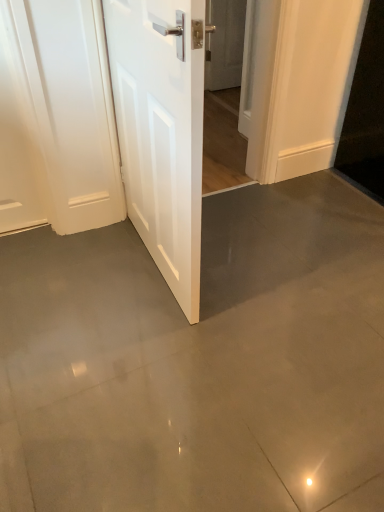
Describe the element at coordinates (161, 130) in the screenshot. The image size is (384, 512). I see `white glossy door at center, positioned as the second door in top-to-bottom order` at that location.

Measure the distance between white glossy door at center, which is the 1th door in front-to-back order, and camera.

The distance of white glossy door at center, which is the 1th door in front-to-back order, from camera is 35.45 inches.

How much space does white glossy door at center, positioned as the second door in top-to-bottom order, occupy horizontally?

5.28 inches.

The width and height of the screenshot is (384, 512). In order to click on white glossy door at center, which is the 1th door in front-to-back order in this screenshot , I will do `click(161, 130)`.

What do you see at coordinates (224, 42) in the screenshot? The width and height of the screenshot is (384, 512). I see `white glossy door at upper center, marked as the second door in a left-to-right arrangement` at bounding box center [224, 42].

From the picture: In order to face white glossy door at upper center, which appears as the first door when viewed from the top, should I rotate leftwards or rightwards?

You should rotate right by 5.742 degrees.

Image resolution: width=384 pixels, height=512 pixels. In order to click on white glossy door at upper center, which is the first door from right to left in this screenshot , I will do `click(224, 42)`.

Find the location of `white glossy door at center, which is the 1th door in front-to-back order`. white glossy door at center, which is the 1th door in front-to-back order is located at coordinates (161, 130).

Consider the image. Can you confirm if white glossy door at upper center, which is the 2th door from bottom to top, is positioned to the right of white glossy door at center, positioned as the second door in top-to-bottom order?

Correct, you'll find white glossy door at upper center, which is the 2th door from bottom to top, to the right of white glossy door at center, positioned as the second door in top-to-bottom order.

Which object is further away from the camera taking this photo, white glossy door at upper center, the 2th door in the front-to-back sequence, or white glossy door at center, positioned as the second door in top-to-bottom order?

white glossy door at upper center, the 2th door in the front-to-back sequence, is further away from the camera.

Is point (233, 56) in front of point (192, 251)?

No.

Based on the photo, from the image's perspective, would you say white glossy door at upper center, marked as the second door in a left-to-right arrangement, is shown under white glossy door at center, positioned as the second door in top-to-bottom order?

No, from the image's perspective, white glossy door at upper center, marked as the second door in a left-to-right arrangement, is not below white glossy door at center, positioned as the second door in top-to-bottom order.

From a real-world perspective, is white glossy door at upper center, which is the 2th door from bottom to top, under white glossy door at center, which is the 1th door in front-to-back order?

Correct, in the physical world, white glossy door at upper center, which is the 2th door from bottom to top, is lower than white glossy door at center, which is the 1th door in front-to-back order.

Is white glossy door at upper center, which is the first door from right to left, wider or thinner than white glossy door at center, placed as the 1th door when sorted from bottom to top?

In the image, white glossy door at upper center, which is the first door from right to left, appears to be more narrow than white glossy door at center, placed as the 1th door when sorted from bottom to top.

Who is shorter, white glossy door at upper center, which is the 1th door from back to front, or white glossy door at center, positioned as the second door in top-to-bottom order?

With less height is white glossy door at upper center, which is the 1th door from back to front.

Looking at the image, does white glossy door at upper center, which is the 1th door from back to front, seem bigger or smaller compared to white glossy door at center, which is the 2th door in back-to-front order?

white glossy door at upper center, which is the 1th door from back to front, is smaller than white glossy door at center, which is the 2th door in back-to-front order.

Is white glossy door at center, placed as the 1th door when sorted from bottom to top, inside white glossy door at upper center, which appears as the first door when viewed from the top?

Actually, white glossy door at center, placed as the 1th door when sorted from bottom to top, is outside white glossy door at upper center, which appears as the first door when viewed from the top.

In the scene shown: Is white glossy door at upper center, which is the 1th door from back to front, not close to white glossy door at center, which is counted as the first door, starting from the left?

Yes.

Is white glossy door at upper center, the 2th door in the front-to-back sequence, turned away from white glossy door at center, which is the 2th door in back-to-front order?

No, white glossy door at upper center, the 2th door in the front-to-back sequence,'s orientation is not away from white glossy door at center, which is the 2th door in back-to-front order.

Can you tell me how much white glossy door at upper center, marked as the second door in a left-to-right arrangement, and white glossy door at center, which is the 1th door in front-to-back order, differ in facing direction?

There is a 88.1-degree angle between the facing directions of white glossy door at upper center, marked as the second door in a left-to-right arrangement, and white glossy door at center, which is the 1th door in front-to-back order.

Measure the distance between white glossy door at upper center, which is the 2th door from bottom to top, and white glossy door at center, placed as the 1th door when sorted from bottom to top.

The distance of white glossy door at upper center, which is the 2th door from bottom to top, from white glossy door at center, placed as the 1th door when sorted from bottom to top, is 1.97 meters.

Find the location of a particular element. This screenshot has height=512, width=384. door that is on the right side of white glossy door at center, which is the 2th door in back-to-front order is located at coordinates (224, 42).

Looking at this image, considering the positions of objects white glossy door at center, placed as the 1th door when sorted from bottom to top, and white glossy door at upper center, which is the 1th door from back to front, in the image provided, who is more to the left, white glossy door at center, placed as the 1th door when sorted from bottom to top, or white glossy door at upper center, which is the 1th door from back to front,?

white glossy door at center, placed as the 1th door when sorted from bottom to top, is more to the left.

In the scene shown: Which object is closer to the camera taking this photo, white glossy door at center, placed as the 1th door when sorted from bottom to top, or white glossy door at upper center, which appears as the first door when viewed from the top?

white glossy door at center, placed as the 1th door when sorted from bottom to top.

Does point (186, 10) appear closer or farther from the camera than point (211, 20)?

Point (186, 10).

From the image's perspective, relative to white glossy door at upper center, marked as the second door in a left-to-right arrangement, is white glossy door at center, which is the 1th door in front-to-back order, above or below?

Based on their image positions, white glossy door at center, which is the 1th door in front-to-back order, is located beneath white glossy door at upper center, marked as the second door in a left-to-right arrangement.

From a real-world perspective, does white glossy door at center, which appears as the 2th door when viewed from the right, stand above white glossy door at upper center, which is the 1th door from back to front?

Yes, from a real-world perspective, white glossy door at center, which appears as the 2th door when viewed from the right, is over white glossy door at upper center, which is the 1th door from back to front

Between white glossy door at center, which is the 2th door in back-to-front order, and white glossy door at upper center, marked as the second door in a left-to-right arrangement, which one has larger width?

Wider between the two is white glossy door at center, which is the 2th door in back-to-front order.

Considering the relative sizes of white glossy door at center, placed as the 1th door when sorted from bottom to top, and white glossy door at upper center, which appears as the first door when viewed from the top, in the image provided, is white glossy door at center, placed as the 1th door when sorted from bottom to top, shorter than white glossy door at upper center, which appears as the first door when viewed from the top,?

No.

Considering the sizes of objects white glossy door at center, positioned as the second door in top-to-bottom order, and white glossy door at upper center, which is the 1th door from back to front, in the image provided, who is smaller, white glossy door at center, positioned as the second door in top-to-bottom order, or white glossy door at upper center, which is the 1th door from back to front,?

With smaller size is white glossy door at upper center, which is the 1th door from back to front.

Is white glossy door at upper center, the 2th door in the front-to-back sequence, a part of white glossy door at center, which is the 1th door in front-to-back order?

No, white glossy door at center, which is the 1th door in front-to-back order, does not contain white glossy door at upper center, the 2th door in the front-to-back sequence.

Are white glossy door at center, which is the 2th door in back-to-front order, and white glossy door at upper center, the 2th door in the front-to-back sequence, far apart?

Yes.

Does white glossy door at center, which is counted as the first door, starting from the left, turn towards white glossy door at upper center, which is the first door from right to left?

No, white glossy door at center, which is counted as the first door, starting from the left, is not turned towards white glossy door at upper center, which is the first door from right to left.

Find the location of a particular element. The image size is (384, 512). door on the left side of white glossy door at upper center, which appears as the first door when viewed from the top is located at coordinates (161, 130).

The height and width of the screenshot is (512, 384). I want to click on door above the white glossy door at center, which is counted as the first door, starting from the left (from the image's perspective), so click(224, 42).

Where is `door positioned vertically above the white glossy door at upper center, which is the first door from right to left (from a real-world perspective)`? door positioned vertically above the white glossy door at upper center, which is the first door from right to left (from a real-world perspective) is located at coordinates (161, 130).